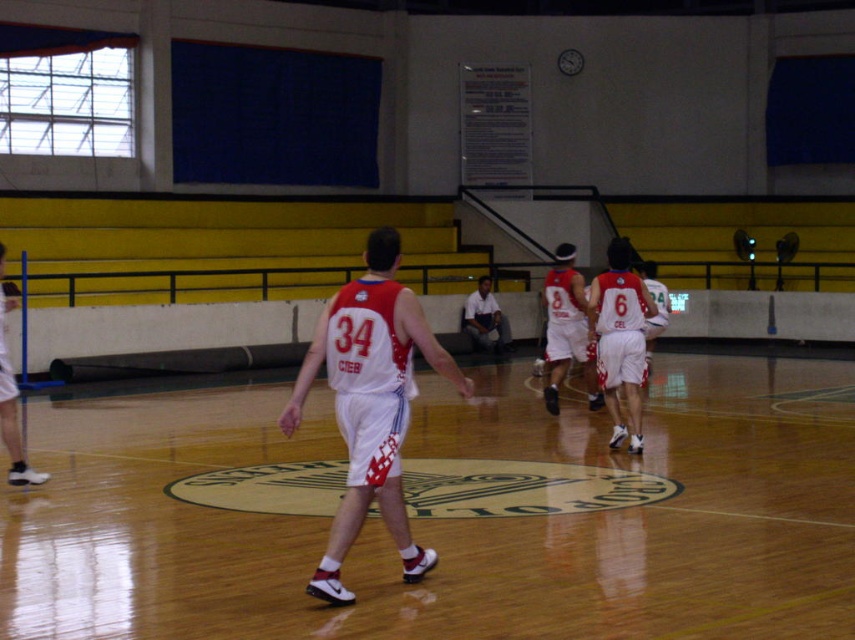
Question: Does white matte basketball hoop at left appear on the right side of white cotton shirt at center?

Choices:
 (A) yes
 (B) no

Answer: (B)

Question: Among these points, which one is farthest from the camera?

Choices:
 (A) (559, 552)
 (B) (351, 305)
 (C) (635, 436)
 (D) (1, 296)

Answer: (C)

Question: Considering the relative positions of wooden floor at center and white matte basketball uniform at center in the image provided, where is wooden floor at center located with respect to white matte basketball uniform at center?

Choices:
 (A) right
 (B) left

Answer: (A)

Question: Which is nearer to the white jersey at center?

Choices:
 (A) white cotton shirt at center
 (B) matte white shorts at right

Answer: (B)

Question: Which point appears farthest from the camera in this image?

Choices:
 (A) (355, 390)
 (B) (551, 348)

Answer: (B)

Question: Does white matte basketball hoop at left appear over white cotton shirt at center?

Choices:
 (A) yes
 (B) no

Answer: (B)